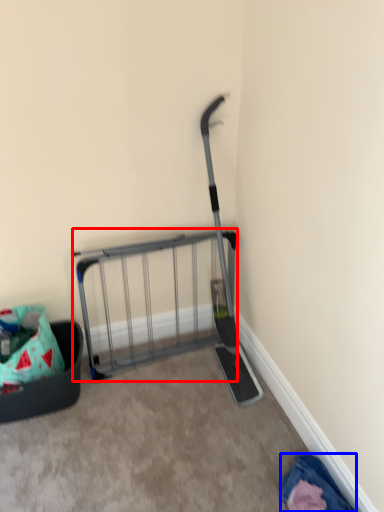
Question: Which object is further to the camera taking this photo, cart (highlighted by a red box) or clothing (highlighted by a blue box)?

Choices:
 (A) cart
 (B) clothing

Answer: (A)